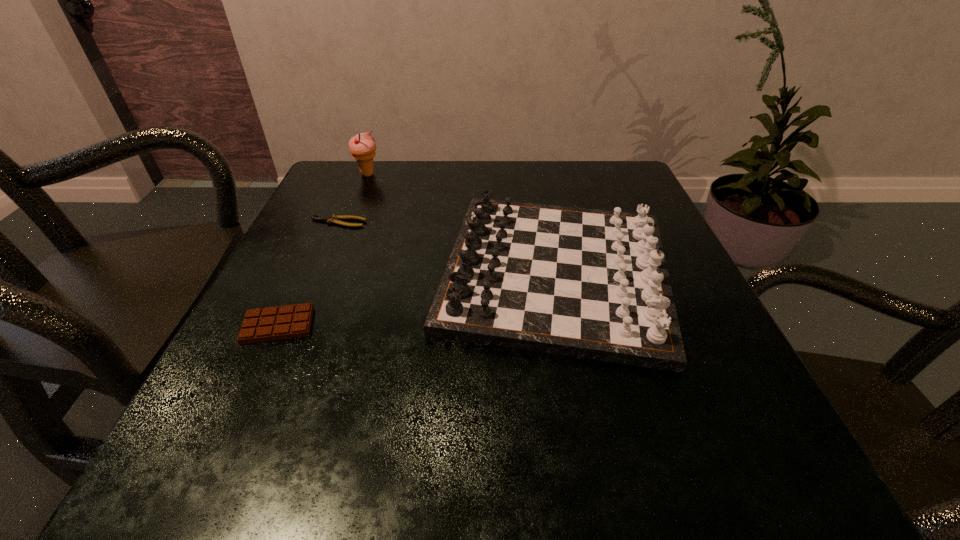
In the image, there is a desktop. Identify the location of vacant region at the left edge. This screenshot has width=960, height=540. (327, 252).

In the image, there is a desktop. Where is `vacant space at the right edge`? This screenshot has width=960, height=540. vacant space at the right edge is located at coordinates (710, 334).

Find the location of a particular element. vacant space at the far left corner is located at coordinates (366, 185).

Locate an element on the screen. Image resolution: width=960 pixels, height=540 pixels. vacant space at the near left corner is located at coordinates (201, 420).

In the image, there is a desktop. Where is `vacant space at the far right corner`? The height and width of the screenshot is (540, 960). vacant space at the far right corner is located at coordinates (623, 190).

At what (x,y) coordinates should I click in order to perform the action: click on free space between the third tallest object and the shortest object. Please return your answer as a coordinate pair (x, y). The height and width of the screenshot is (540, 960). Looking at the image, I should click on (308, 274).

The width and height of the screenshot is (960, 540). Identify the location of free space between the tallest object and the candy bar. (323, 250).

Identify the location of free space that is in between the rightmost object and the candy bar. Image resolution: width=960 pixels, height=540 pixels. (417, 299).

Locate an element on the screen. The height and width of the screenshot is (540, 960). vacant area between the shortest object and the second shortest object is located at coordinates (308, 274).

I want to click on vacant region between the candy bar and the second tallest object, so click(417, 299).